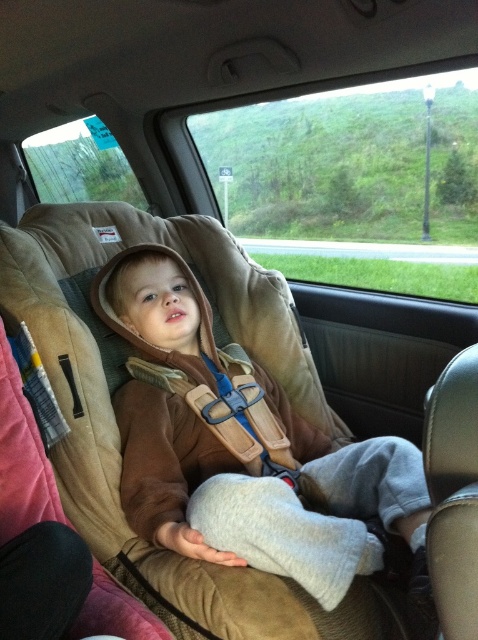
What are the coordinates of the brown suede hoodie at center in the image?

The brown suede hoodie at center is located at coordinates point [241,445].